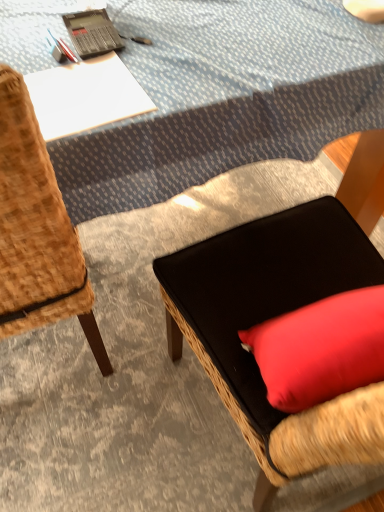
This screenshot has height=512, width=384. Identify the location of vacant space behind white paper at upper left. (85, 12).